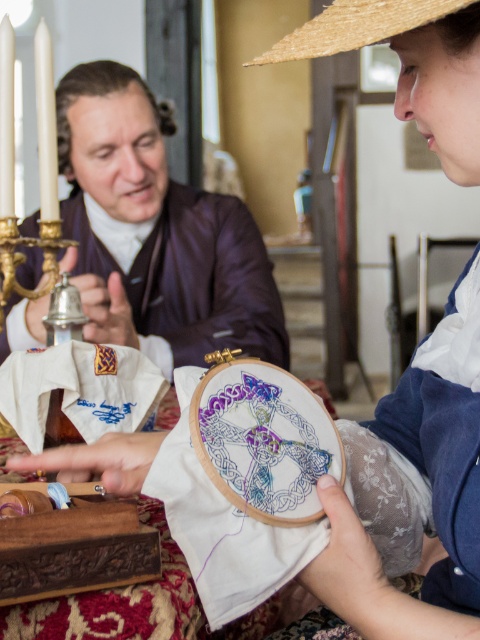
Between point (119, 282) and point (330, 51), which one is positioned in front?

Point (330, 51)

Is purple silk jacket at upper center below straw hat at upper center?

Actually, purple silk jacket at upper center is above straw hat at upper center.

Is point (182, 358) positioned after point (414, 16)?

Yes, it is behind point (414, 16).

The width and height of the screenshot is (480, 640). I want to click on purple silk jacket at upper center, so click(156, 232).